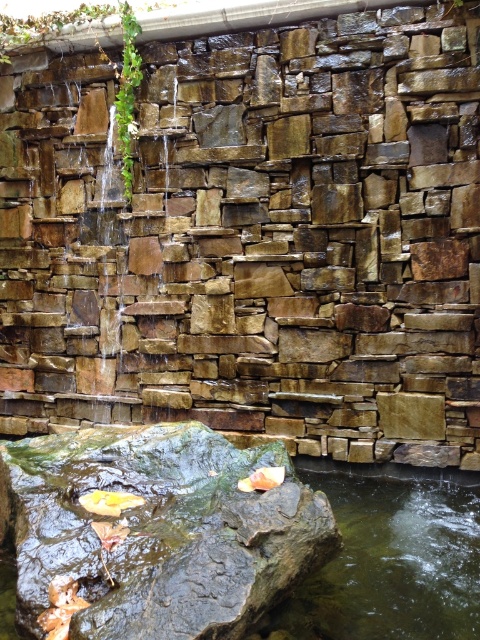
Question: Is brown rough stone at center closer to camera compared to rough textured rock at center?

Choices:
 (A) no
 (B) yes

Answer: (A)

Question: Which object appears closest to the camera in this image?

Choices:
 (A) brown rough stone at center
 (B) rough textured rock at center

Answer: (B)

Question: Which of the following is the closest to the observer?

Choices:
 (A) (168, 451)
 (B) (17, 173)

Answer: (A)

Question: Is brown rough stone at center bigger than rough textured rock at center?

Choices:
 (A) yes
 (B) no

Answer: (A)

Question: Can you confirm if brown rough stone at center is thinner than rough textured rock at center?

Choices:
 (A) no
 (B) yes

Answer: (A)

Question: Which of the following is the closest to the observer?

Choices:
 (A) (347, 56)
 (B) (327, 545)

Answer: (B)